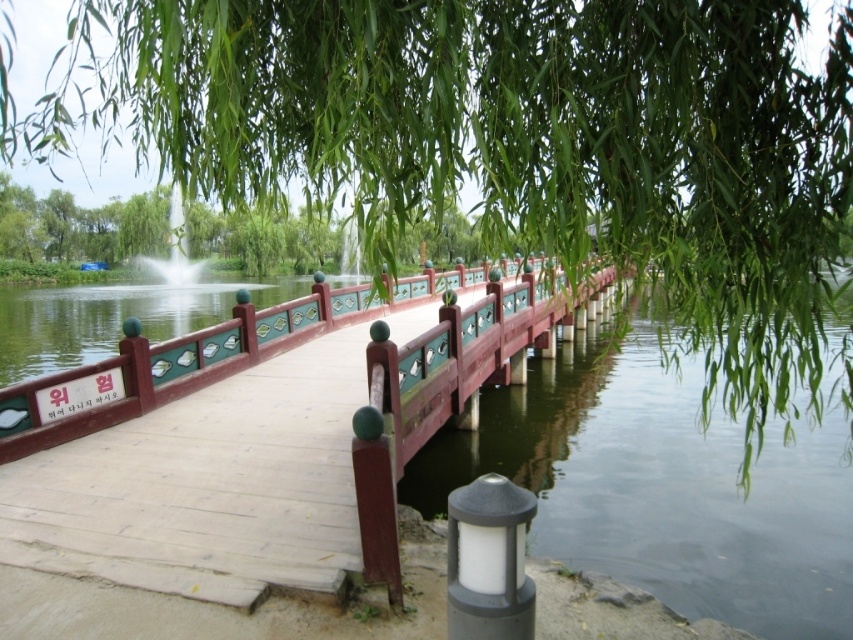
What do you see at coordinates (256, 440) in the screenshot?
I see `wooden dock at center` at bounding box center [256, 440].

Can you confirm if wooden dock at center is bigger than matte gray lamp post at lower center?

Yes.

The image size is (853, 640). What do you see at coordinates (256, 440) in the screenshot? I see `wooden dock at center` at bounding box center [256, 440].

I want to click on wooden dock at center, so click(256, 440).

In the scene shown: Can you confirm if wooden dock at center is shorter than green leafy tree at upper center?

Yes.

Does wooden dock at center appear over green leafy tree at upper center?

Incorrect, wooden dock at center is not positioned above green leafy tree at upper center.

Where is `wooden dock at center`? The width and height of the screenshot is (853, 640). wooden dock at center is located at coordinates (256, 440).

Find the location of a particular element. wooden dock at center is located at coordinates (256, 440).

Does point (68, 461) come behind point (428, 394)?

That is False.

Find the location of a particular element. This screenshot has height=640, width=853. wooden dock at center is located at coordinates (256, 440).